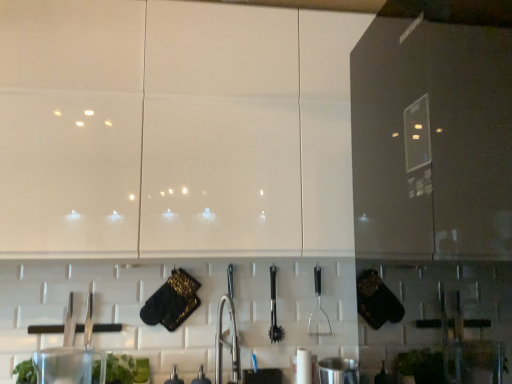
Question: Is green leafy plant at lower left wider or thinner than metallic faucet at center, the 2th appliance when ordered from right to left?

Choices:
 (A) wide
 (B) thin

Answer: (A)

Question: Is point (120, 354) positioned closer to the camera than point (202, 375)?

Choices:
 (A) closer
 (B) farther

Answer: (A)

Question: Which object is the farthest from the green leafy plant at lower left?

Choices:
 (A) satin nickel faucet at center
 (B) transparent plastic container at lower left, the 4th appliance viewed from the right
 (C) metallic silver faucet at center, the 2th appliance in the left-to-right sequence
 (D) metallic faucet at center, the 2th appliance when ordered from right to left
 (E) stainless steel pot at lower center, which ranks as the 4th appliance in left-to-right order

Answer: (E)

Question: Which object is positioned closest to the stainless steel pot at lower center, the 1th appliance viewed from the right?

Choices:
 (A) green leafy plant at lower left
 (B) black plastic spatula at center-right, the 2th silverware viewed from the left
 (C) polished metal tongs at center, acting as the 1th silverware starting from the left
 (D) metallic faucet at center, the third appliance from the left
 (E) metallic silver faucet at center, the 2th appliance in the left-to-right sequence

Answer: (B)